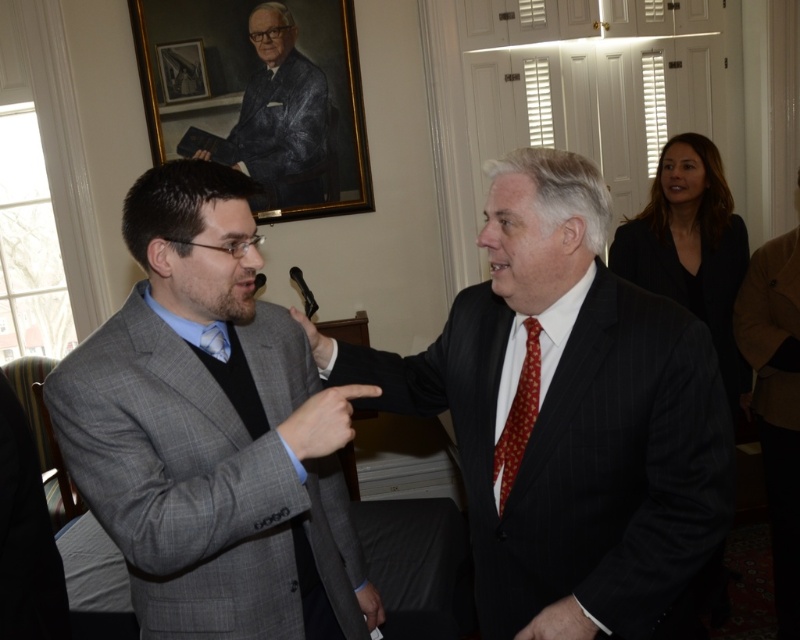
Question: Is blue fabric suit at upper center wider than wooden picture frame at upper center?

Choices:
 (A) yes
 (B) no

Answer: (A)

Question: Does matte black suit at center appear on the right side of wooden picture frame at upper center?

Choices:
 (A) yes
 (B) no

Answer: (A)

Question: Which object is the farthest from the matte black suit at center?

Choices:
 (A) brown wool coat at lower right
 (B) red silk tie at center
 (C) gray checkered suit at center

Answer: (A)

Question: Which of the following is the farthest from the observer?

Choices:
 (A) (10, 561)
 (B) (504, 488)

Answer: (B)

Question: Does gray checkered suit at center appear on the right side of wooden picture frame at upper center?

Choices:
 (A) yes
 (B) no

Answer: (A)

Question: Which is farther from the red silk tie at center?

Choices:
 (A) wooden picture frame at upper center
 (B) brown wool coat at lower right
 (C) blue fabric suit at upper center
 (D) gray checkered suit at center

Answer: (A)